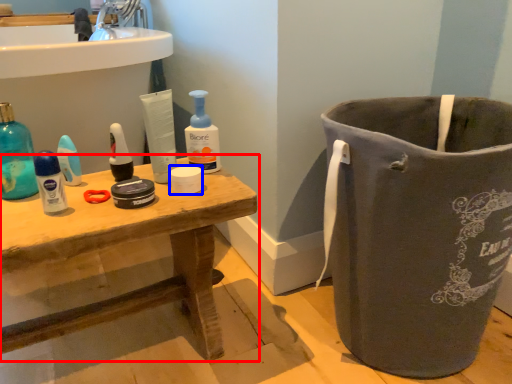
Question: Among these objects, which one is farthest to the camera, table (highlighted by a red box) or toilet paper (highlighted by a blue box)?

Choices:
 (A) table
 (B) toilet paper

Answer: (B)